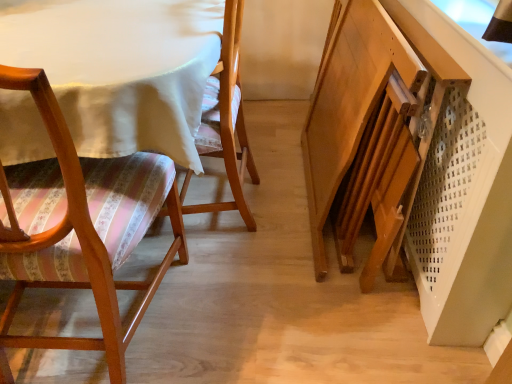
Question: Is wooden floral-patterned chair at left, which ranks as the second chair in left-to-right order, facing towards matte wood chair at left, which appears as the first chair when viewed from the left?

Choices:
 (A) yes
 (B) no

Answer: (B)

Question: Does wooden floral-patterned chair at left, the 1th chair viewed from the right, have a larger size compared to matte wood chair at left, which appears as the first chair when viewed from the left?

Choices:
 (A) no
 (B) yes

Answer: (A)

Question: Is wooden floral-patterned chair at left, which ranks as the second chair in left-to-right order, shorter than matte wood chair at left, the second chair from the right?

Choices:
 (A) yes
 (B) no

Answer: (A)

Question: Is the position of wooden floral-patterned chair at left, the 1th chair viewed from the right, less distant than that of matte wood chair at left, which appears as the first chair when viewed from the left?

Choices:
 (A) no
 (B) yes

Answer: (A)

Question: Is wooden floral-patterned chair at left, the 1th chair viewed from the right, positioned with its back to matte wood chair at left, the second chair from the right?

Choices:
 (A) yes
 (B) no

Answer: (B)

Question: Is wooden floral-patterned chair at left, the 1th chair viewed from the right, at the left side of matte wood chair at left, which appears as the first chair when viewed from the left?

Choices:
 (A) yes
 (B) no

Answer: (B)

Question: From the image's perspective, is matte wood chair at left, which appears as the first chair when viewed from the left, located above wooden floral-patterned chair at left, which ranks as the second chair in left-to-right order?

Choices:
 (A) no
 (B) yes

Answer: (A)

Question: Can you confirm if matte wood chair at left, which appears as the first chair when viewed from the left, is thinner than wooden floral-patterned chair at left, the 1th chair viewed from the right?

Choices:
 (A) no
 (B) yes

Answer: (A)

Question: Is wooden floral-patterned chair at left, which ranks as the second chair in left-to-right order, located within matte wood chair at left, which appears as the first chair when viewed from the left?

Choices:
 (A) yes
 (B) no

Answer: (B)

Question: Does matte wood chair at left, the second chair from the right, lie in front of wooden floral-patterned chair at left, the 1th chair viewed from the right?

Choices:
 (A) yes
 (B) no

Answer: (A)

Question: Can you confirm if matte wood chair at left, the second chair from the right, is shorter than wooden floral-patterned chair at left, the 1th chair viewed from the right?

Choices:
 (A) no
 (B) yes

Answer: (A)

Question: Considering the relative positions of matte wood chair at left, which appears as the first chair when viewed from the left, and wooden floral-patterned chair at left, which ranks as the second chair in left-to-right order, in the image provided, is matte wood chair at left, which appears as the first chair when viewed from the left, to the left of wooden floral-patterned chair at left, which ranks as the second chair in left-to-right order, from the viewer's perspective?

Choices:
 (A) yes
 (B) no

Answer: (A)

Question: Visually, is wooden floral-patterned chair at left, which ranks as the second chair in left-to-right order, positioned to the left or to the right of matte wood chair at left, which appears as the first chair when viewed from the left?

Choices:
 (A) right
 (B) left

Answer: (A)